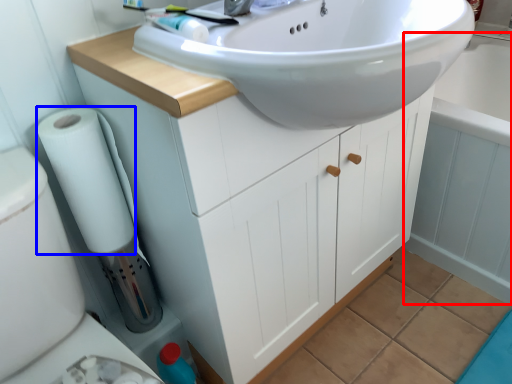
Question: Among these objects, which one is farthest to the camera, bath (highlighted by a red box) or toilet paper (highlighted by a blue box)?

Choices:
 (A) bath
 (B) toilet paper

Answer: (A)